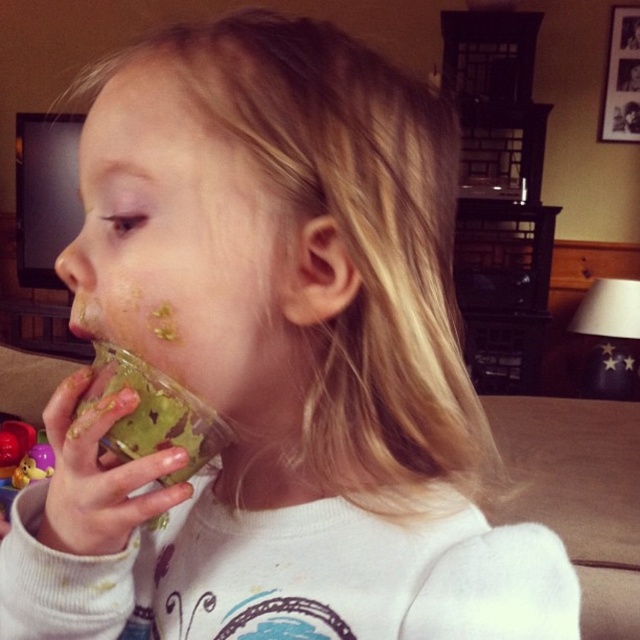
You are a photographer trying to capture a closeup of the child without moving any objects. Which object, the green leafy drink at mouth or the rubber duck at lower left, will appear larger in the photo?

The green leafy drink at mouth will appear larger in the photo because it is closer to the viewer than the rubber duck at lower left.

From the picture: You are a delivery robot standing at a point 31.81 centimeters away from the viewer. You need to deliver a small package to the point marked as point (221, 426). Can you reach that point safely?

The distance between you and point (221, 426) is 31.81 centimeters, so yes, you can safely reach that point to deliver the package.

Looking at this image, what is the exact coordinate of the green leafy drink at mouth?

The green leafy drink at mouth is located at point [152,413].